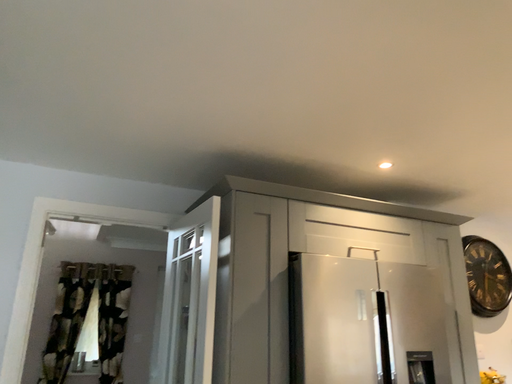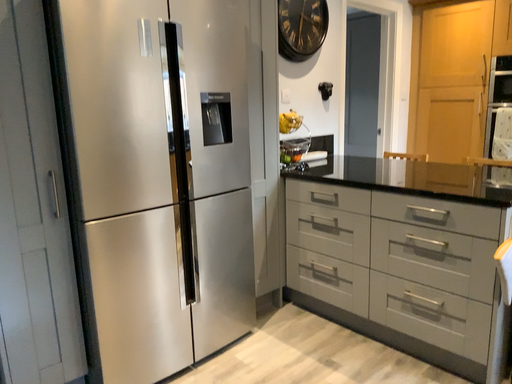
Question: Which way did the camera rotate in the video?

Choices:
 (A) rotated left
 (B) rotated right

Answer: (B)